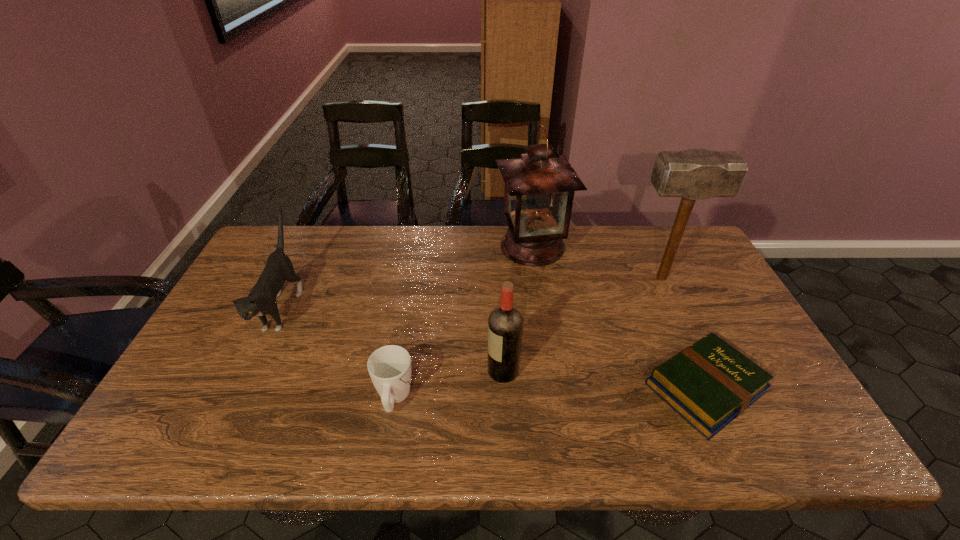
This screenshot has width=960, height=540. I want to click on free spot between the liquor and the fourth tallest object, so click(393, 339).

At what (x,y) coordinates should I click in order to perform the action: click on vacant area that lies between the mug and the cat. Please return your answer as a coordinate pair (x, y). Looking at the image, I should click on (339, 352).

The width and height of the screenshot is (960, 540). Find the location of `vacant space that's between the shortest object and the liquor`. vacant space that's between the shortest object and the liquor is located at coordinates (604, 380).

Identify the location of free point between the oil lamp and the mallet. The width and height of the screenshot is (960, 540). (597, 262).

Image resolution: width=960 pixels, height=540 pixels. I want to click on vacant point located between the liquor and the mallet, so click(583, 325).

In order to click on blank region between the fourth tallest object and the mallet in this screenshot , I will do `click(472, 292)`.

Where is `the third closest object to the oil lamp`? the third closest object to the oil lamp is located at coordinates (505, 323).

Identify which object is the third closest to the shortest object. Please provide its 2D coordinates. Your answer should be formatted as a tuple, i.e. [(x, y)], where the tuple contains the x and y coordinates of a point satisfying the conditions above.

[(539, 190)]

You are a GUI agent. You are given a task and a screenshot of the screen. Output one action in this format:
    pyautogui.click(x=<x>, y=<y>)
    Task: Click on the free space in the image that satisfies the following two spatial constraints: 1. on the front side of the oil lamp; 2. on the right side of the book
    
    Given the screenshot: What is the action you would take?
    pyautogui.click(x=553, y=388)

Locate an element on the screen. This screenshot has height=540, width=960. free location that satisfies the following two spatial constraints: 1. on the side of the mug with the handle; 2. on the right side of the book is located at coordinates pyautogui.click(x=396, y=388).